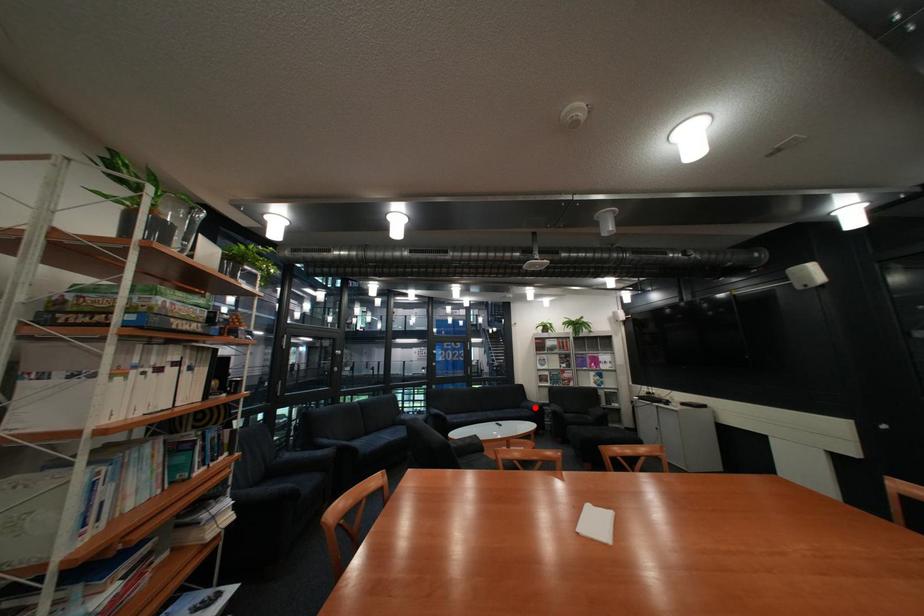
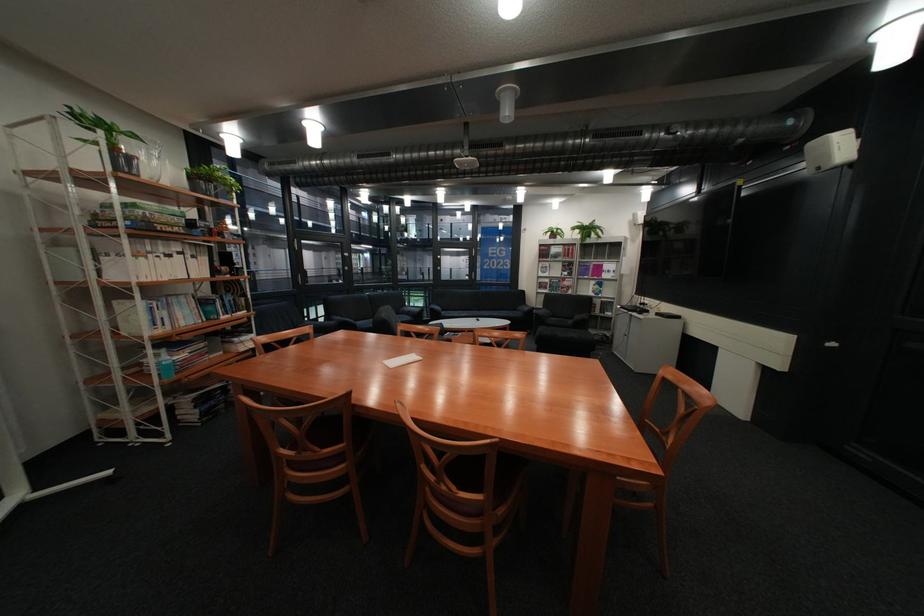
Question: I am providing you with two images of the same scene from different viewpoints. A red point is shown in image1. For the corresponding object point in image2, is it positioned nearer or farther from the camera?

Choices:
 (A) Nearer
 (B) Farther

Answer: (A)